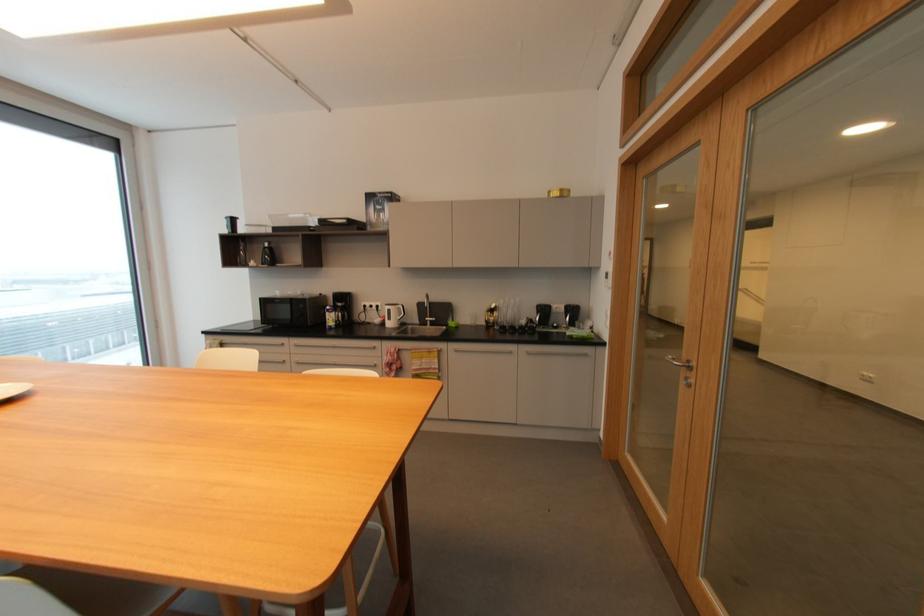
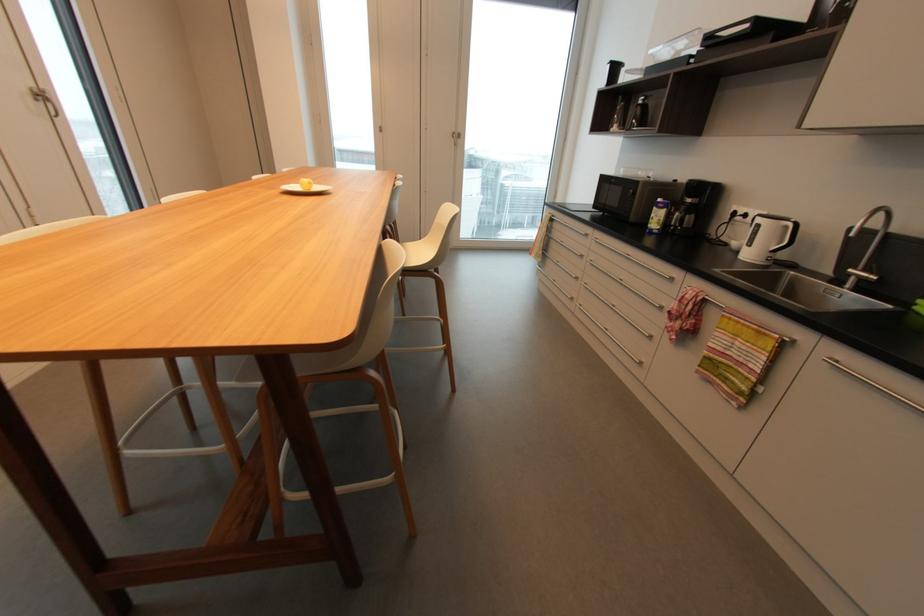
Where in the second image is the point corresponding to (395,361) from the first image?

(681, 310)